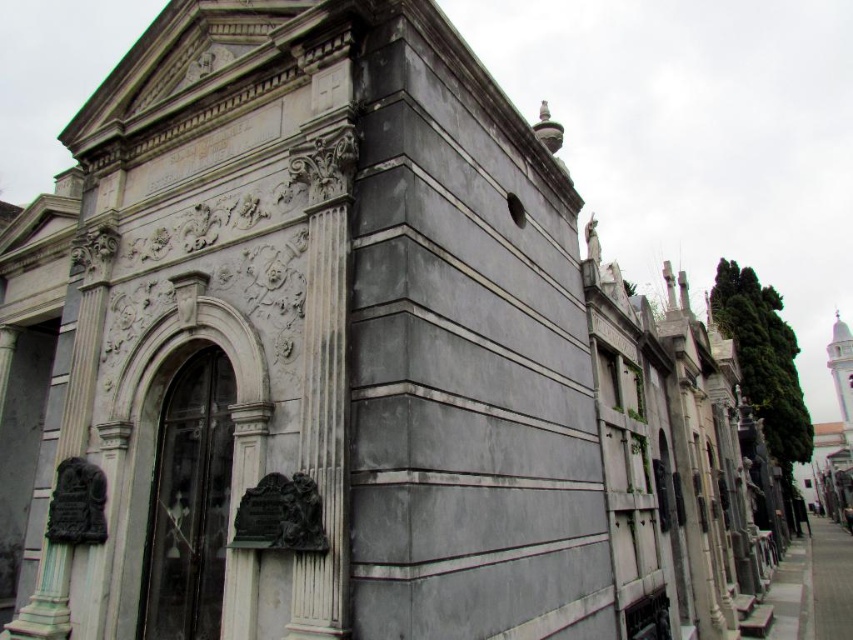
Question: Which of the following is the farthest from the observer?

Choices:
 (A) (541, 509)
 (B) (309, 356)

Answer: (A)

Question: Which of the following is the closest to the observer?

Choices:
 (A) (582, 301)
 (B) (332, 422)

Answer: (B)

Question: Does gray marble statue at center lie in front of white marble column at center?

Choices:
 (A) no
 (B) yes

Answer: (B)

Question: Does gray marble statue at center appear over white marble column at center?

Choices:
 (A) yes
 (B) no

Answer: (A)

Question: Which of the following is the closest to the observer?

Choices:
 (A) (325, 308)
 (B) (368, 100)

Answer: (A)

Question: Does gray marble statue at center lie behind white marble column at center?

Choices:
 (A) yes
 (B) no

Answer: (B)